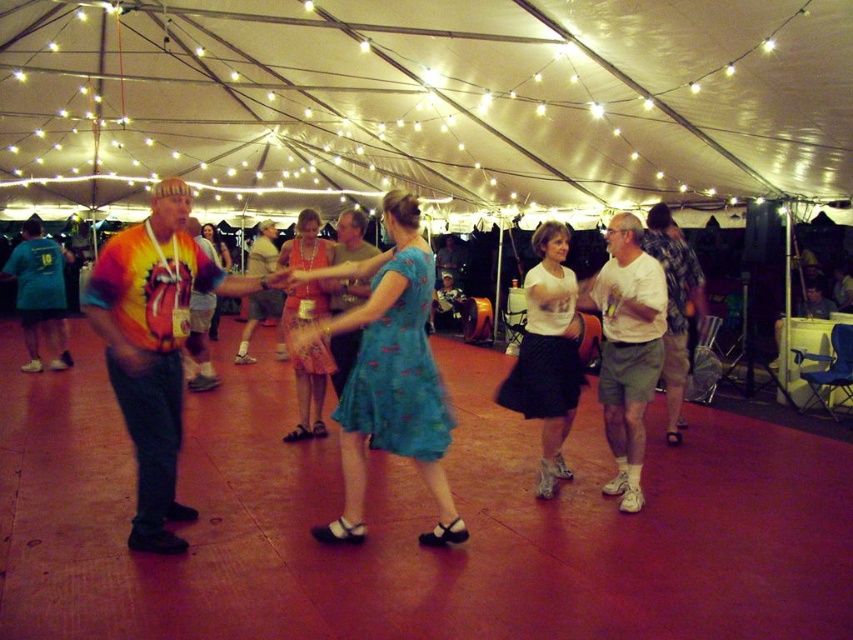
Question: Based on their relative distances, which object is nearer to the blue satin dress at center?

Choices:
 (A) matte tie-dye shirt at center
 (B) floral satin dress at center

Answer: (B)

Question: Which point is closer to the camera taking this photo?

Choices:
 (A) (550, 371)
 (B) (410, 440)

Answer: (B)

Question: Among these objects, which one is farthest from the camera?

Choices:
 (A) white fabric canopy at upper center
 (B) rainbow tie-dye shirt at left
 (C) matte tie-dye shirt at center

Answer: (C)

Question: Does shiny pink dress at center appear under camouflage fabric shirt at right?

Choices:
 (A) no
 (B) yes

Answer: (B)

Question: Is rainbow tie-dye shirt at left to the right of camouflage fabric shirt at right from the viewer's perspective?

Choices:
 (A) yes
 (B) no

Answer: (B)

Question: Is rainbow tie-dye shirt at left positioned in front of blue satin dress at center?

Choices:
 (A) yes
 (B) no

Answer: (A)